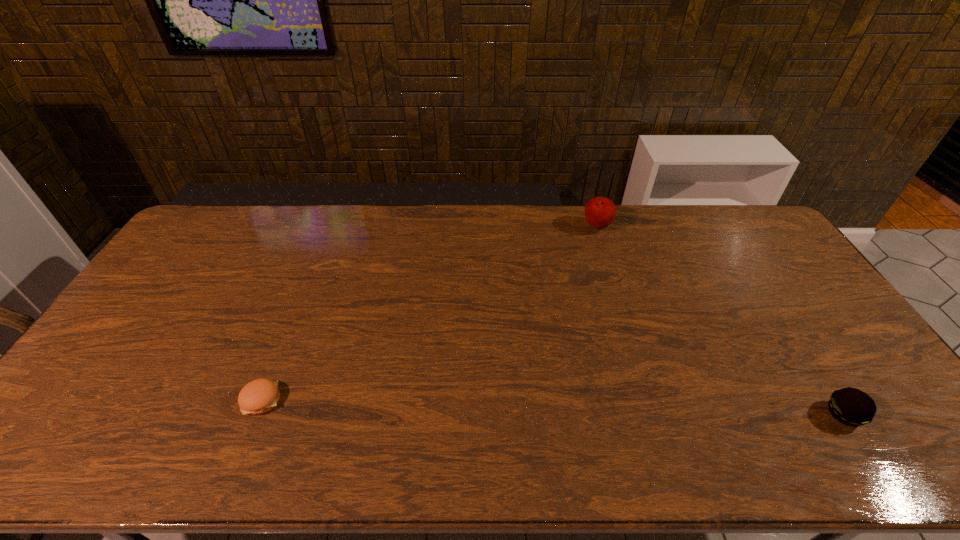
Find the location of a particular element. The image size is (960, 540). object located at the right edge is located at coordinates (850, 406).

At what (x,y) coordinates should I click in order to perform the action: click on vacant region at the far edge. Please return your answer as a coordinate pair (x, y). Looking at the image, I should click on (229, 243).

Locate an element on the screen. free region at the near edge is located at coordinates (186, 443).

Image resolution: width=960 pixels, height=540 pixels. Identify the location of vacant space at the left edge of the desktop. (197, 281).

In the image, there is a desktop. Find the location of `vacant space at the right edge`. vacant space at the right edge is located at coordinates (820, 353).

In the image, there is a desktop. At what (x,y) coordinates should I click in order to perform the action: click on free space at the near right corner. Please return your answer as a coordinate pair (x, y). Looking at the image, I should click on (877, 470).

Where is `vacant space that's between the farthest object and the left patty`? The image size is (960, 540). vacant space that's between the farthest object and the left patty is located at coordinates (429, 314).

The image size is (960, 540). In order to click on free space between the taller patty and the apple in this screenshot , I will do `click(720, 321)`.

Locate an element on the screen. The width and height of the screenshot is (960, 540). vacant region between the right patty and the second object from right to left is located at coordinates (720, 321).

Where is `empty location between the right patty and the second object from right to left`? This screenshot has height=540, width=960. empty location between the right patty and the second object from right to left is located at coordinates (720, 321).